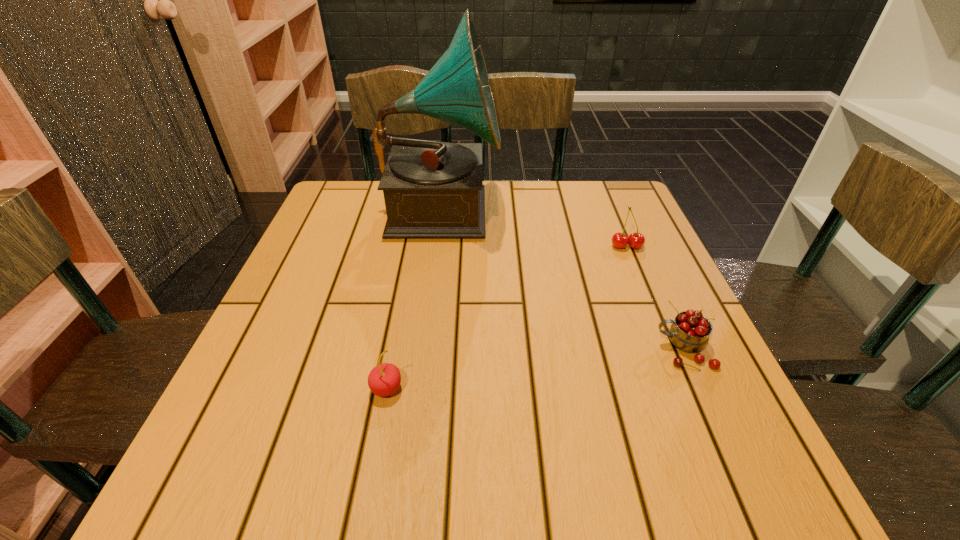
Identify the location of free space that satisfies the following two spatial constraints: 1. with the stems of the third nearest object pointing upwards; 2. on the handle side of the second farthest cherry. The height and width of the screenshot is (540, 960). (669, 349).

Locate an element on the screen. This screenshot has height=540, width=960. free location that satisfies the following two spatial constraints: 1. on the handle side of the third farthest object; 2. with the stems of the farthest cherry pointing upwards is located at coordinates (637, 246).